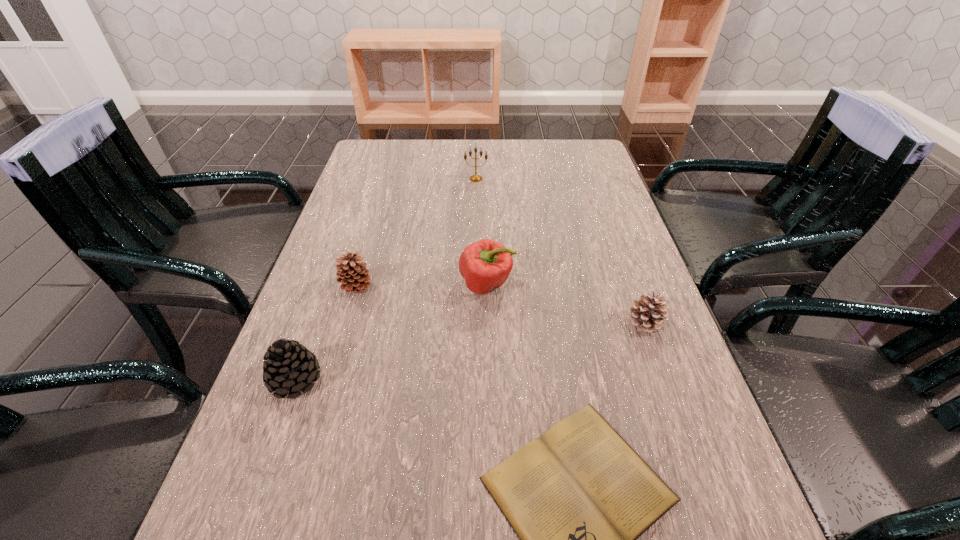
Find the location of a particular element. The image size is (960, 540). candelabrum is located at coordinates (474, 178).

In order to click on bell pepper in this screenshot , I will do `click(485, 265)`.

This screenshot has height=540, width=960. I want to click on the farthest pinecone, so click(351, 271).

Find the location of a particular element. This screenshot has width=960, height=540. the second nearest object is located at coordinates (290, 368).

You are a GUI agent. You are given a task and a screenshot of the screen. Output one action in this format:
    pyautogui.click(x=<x>, y=<y>)
    Task: Click on the shortest pinecone
    This screenshot has width=960, height=540.
    Given the screenshot: What is the action you would take?
    pyautogui.click(x=647, y=313)

I want to click on the rightmost object, so click(x=647, y=313).

This screenshot has width=960, height=540. What are the coordinates of `free space located 0.310m on the front of the farthest object` in the screenshot? It's located at (475, 248).

Locate an element on the screen. vacant space located on the front of the bell pepper is located at coordinates (490, 490).

At what (x,y) coordinates should I click in order to perform the action: click on free location located on the right of the farthest pinecone. Please return your answer as a coordinate pair (x, y). This screenshot has width=960, height=540. Looking at the image, I should click on (492, 287).

The width and height of the screenshot is (960, 540). In order to click on vacant space located at the narrow end of the fifth farthest object in this screenshot , I will do pyautogui.click(x=387, y=380).